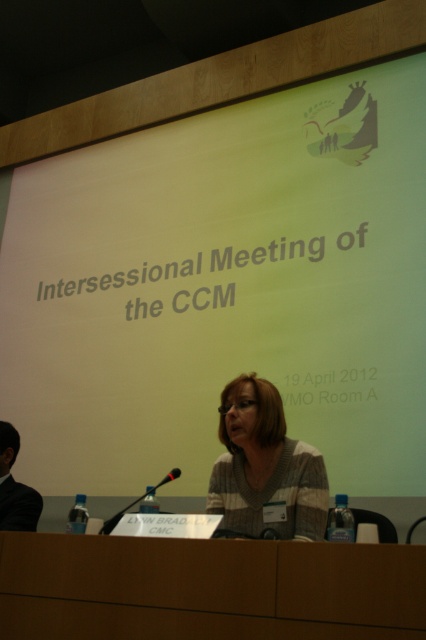
Question: Does green matte projection screen at upper center appear on the left side of black plastic microphone at center?

Choices:
 (A) yes
 (B) no

Answer: (B)

Question: Which point appears farthest from the camera in this image?

Choices:
 (A) (65, 534)
 (B) (282, 509)

Answer: (B)

Question: Does knit sweater at center appear over black plastic microphone at center?

Choices:
 (A) no
 (B) yes

Answer: (B)

Question: Among these points, which one is nearest to the camera?

Choices:
 (A) (285, 525)
 (B) (63, 628)
 (C) (60, 234)

Answer: (B)

Question: From the image, what is the correct spatial relationship of knit sweater at center in relation to black plastic microphone at center?

Choices:
 (A) above
 (B) below

Answer: (A)

Question: Considering the real-world distances, which object is closest to the brown wood table at center?

Choices:
 (A) black suit at left
 (B) black plastic microphone at center

Answer: (B)